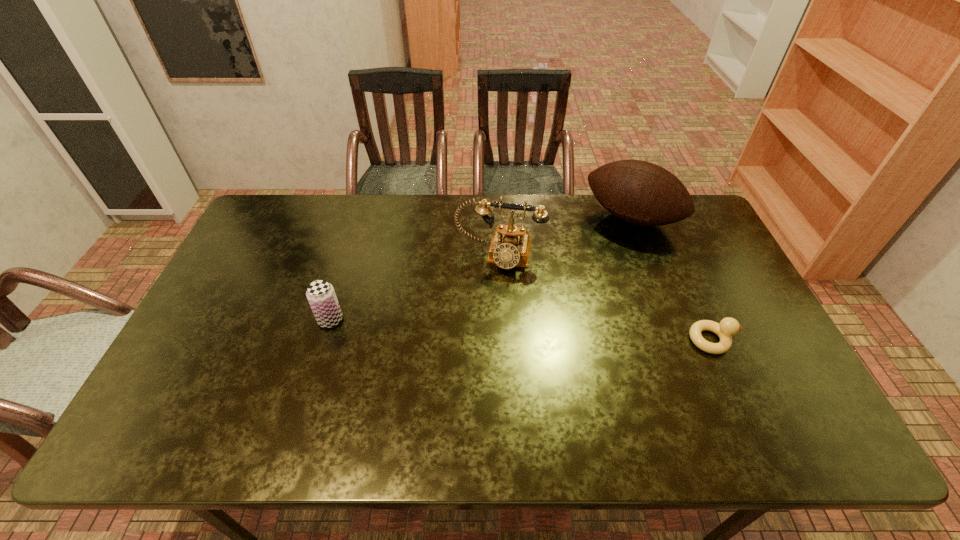
Where is `free spot on the desktop that is between the third tallest object and the duckling and is positioned on the dial number of the third object from right to left`? This screenshot has height=540, width=960. free spot on the desktop that is between the third tallest object and the duckling and is positioned on the dial number of the third object from right to left is located at coordinates (484, 328).

In order to click on vacant space on the desktop that is between the second shortest object and the shortest object and is positioned on the laces of the football in this screenshot , I will do `click(560, 332)`.